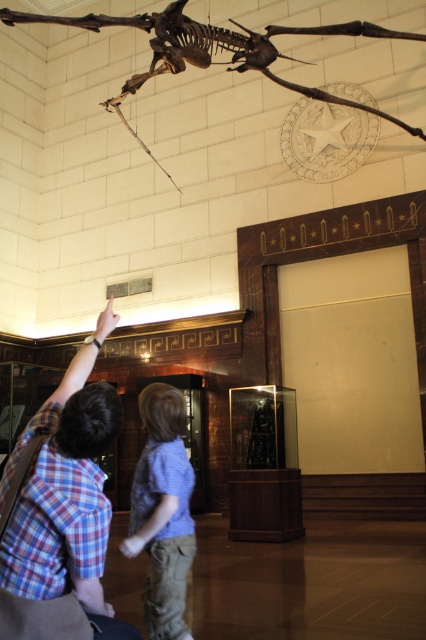
Question: Is blue cotton shirt at center in front of brown bone-like at upper center?

Choices:
 (A) yes
 (B) no

Answer: (A)

Question: Which object is the closest to the blue cotton shirt at center?

Choices:
 (A) brown bone-like at upper center
 (B) plaid shirt at lower left

Answer: (B)

Question: Which object is closer to the camera taking this photo?

Choices:
 (A) blue cotton shirt at center
 (B) brown bone-like at upper center
 (C) plaid shirt at lower left

Answer: (C)

Question: Can you confirm if blue cotton shirt at center is positioned above brown bone-like at upper center?

Choices:
 (A) yes
 (B) no

Answer: (B)

Question: Among these points, which one is nearest to the camera?

Choices:
 (A) (89, 586)
 (B) (394, 36)
 (C) (167, 572)

Answer: (A)

Question: Where is blue cotton shirt at center located in relation to brown bone-like at upper center in the image?

Choices:
 (A) left
 (B) right

Answer: (A)